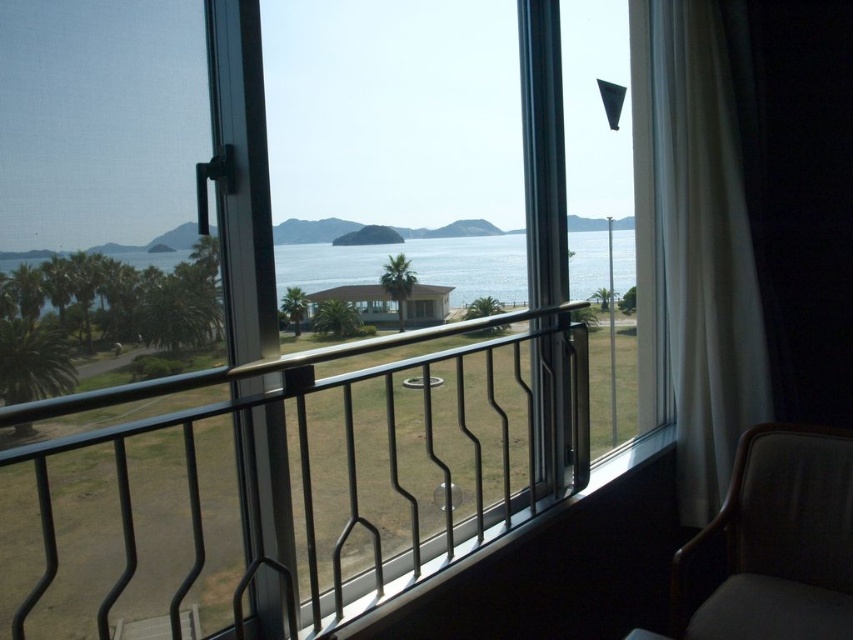
Question: Considering the real-world distances, which object is farthest from the white sheer curtain at right?

Choices:
 (A) clear glass screen door at left
 (B) black metal railing at center
 (C) clear blue water at center

Answer: (A)

Question: Which point is farther to the camera?

Choices:
 (A) clear glass screen door at left
 (B) white sheer curtain at right
 (C) black metal railing at center

Answer: (B)

Question: Is black metal railing at center bigger than clear blue water at center?

Choices:
 (A) yes
 (B) no

Answer: (A)

Question: Among these points, which one is farthest from the camera?

Choices:
 (A) (430, 250)
 (B) (15, 596)
 (C) (850, 490)

Answer: (A)

Question: Does clear glass screen door at left appear over dark brown fabric armchair at lower right?

Choices:
 (A) no
 (B) yes

Answer: (B)

Question: In this image, where is clear glass screen door at left located relative to black metal railing at center?

Choices:
 (A) below
 (B) above

Answer: (B)